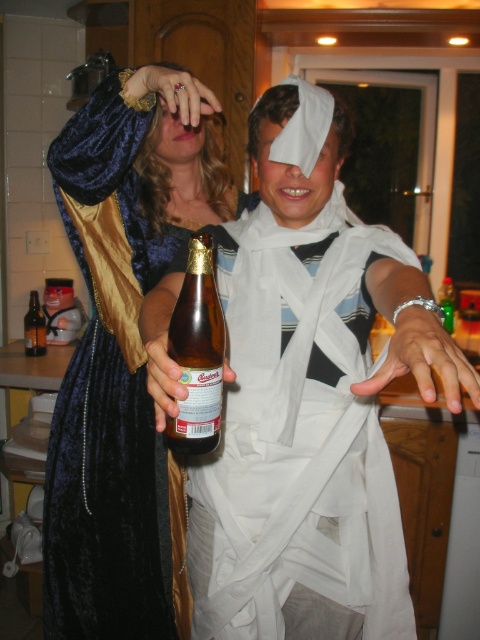
Question: Can you confirm if white paper robe at center is smaller than brown glass beer bottle at center?

Choices:
 (A) no
 (B) yes

Answer: (A)

Question: Is brown glass beer bottle at center above brown glass bottle at lower left?

Choices:
 (A) no
 (B) yes

Answer: (A)

Question: Does white paper robe at center have a smaller size compared to brown glass bottle at center?

Choices:
 (A) no
 (B) yes

Answer: (A)

Question: Which object appears farthest from the camera in this image?

Choices:
 (A) brown glass bottle at center
 (B) velvet dress at center

Answer: (A)

Question: Considering the real-world distances, which object is closest to the white paper robe at center?

Choices:
 (A) brown glass bottle at lower left
 (B) brown glass bottle at center

Answer: (B)

Question: Which object is positioned farthest from the velvet dress at center?

Choices:
 (A) brown glass beer bottle at center
 (B) brown glass bottle at center

Answer: (B)